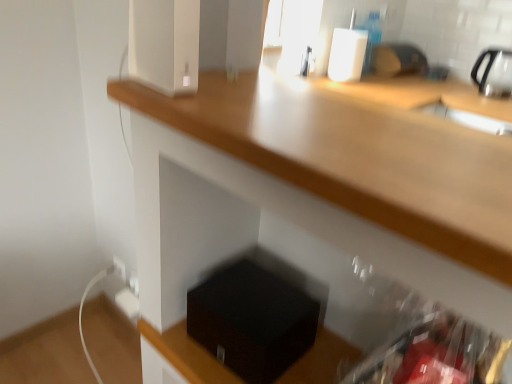
Question: From the image's perspective, is white glossy speaker at upper center located above or below black matte box at lower center?

Choices:
 (A) below
 (B) above

Answer: (B)

Question: Looking at the image, does white glossy speaker at upper center seem bigger or smaller compared to black matte box at lower center?

Choices:
 (A) big
 (B) small

Answer: (B)

Question: Would you say white glossy speaker at upper center is inside or outside black matte box at lower center?

Choices:
 (A) outside
 (B) inside

Answer: (A)

Question: Is point (253, 380) closer or farther from the camera than point (161, 6)?

Choices:
 (A) farther
 (B) closer

Answer: (A)

Question: Is black matte box at lower center inside or outside of white glossy speaker at upper center?

Choices:
 (A) outside
 (B) inside

Answer: (A)

Question: Based on their sizes in the image, would you say black matte box at lower center is bigger or smaller than white glossy speaker at upper center?

Choices:
 (A) small
 (B) big

Answer: (B)

Question: Is black matte box at lower center in front of or behind white glossy speaker at upper center in the image?

Choices:
 (A) behind
 (B) front

Answer: (A)